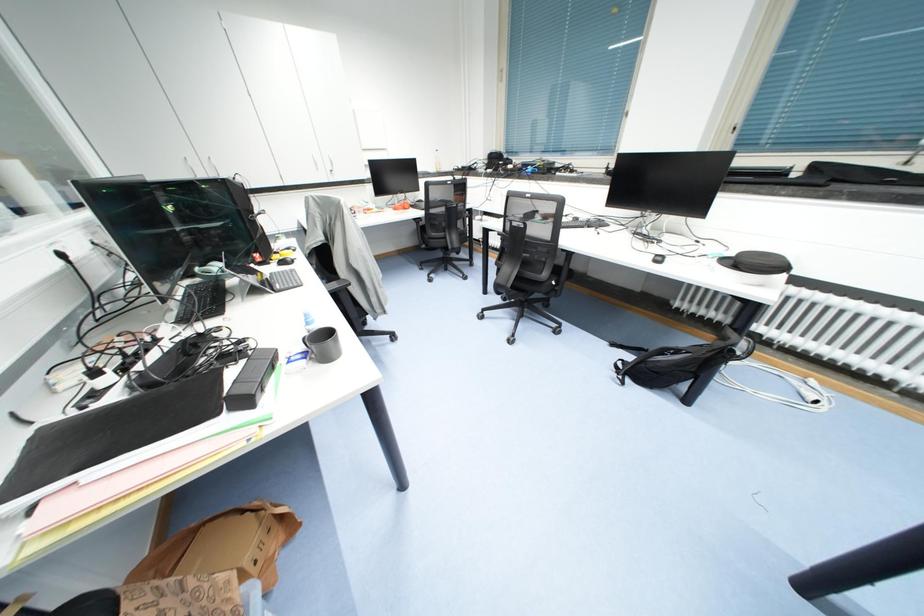
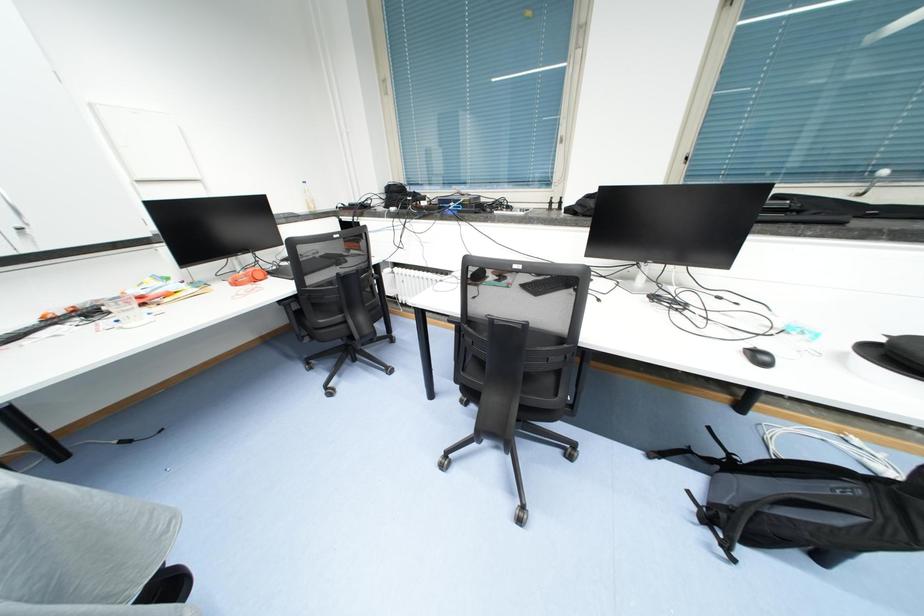
Question: In a continuous first-person perspective shot, in which direction is the camera moving?

Choices:
 (A) Left
 (B) Right
 (C) Forward
 (D) Backward

Answer: (C)